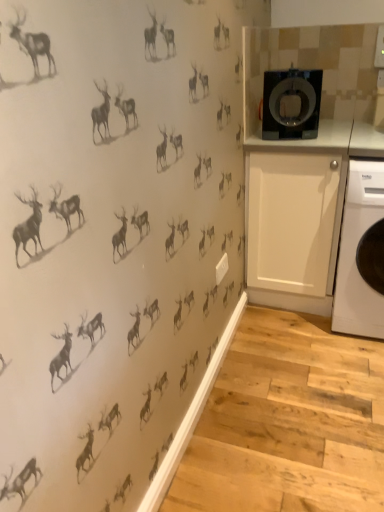
Question: Considering the relative positions of white matte cabinet at right and black glossy washing machine at upper right in the image provided, is white matte cabinet at right behind black glossy washing machine at upper right?

Choices:
 (A) yes
 (B) no

Answer: (A)

Question: Can you confirm if white matte cabinet at right is shorter than black glossy washing machine at upper right?

Choices:
 (A) no
 (B) yes

Answer: (A)

Question: Is white matte cabinet at right directly adjacent to black glossy washing machine at upper right?

Choices:
 (A) no
 (B) yes

Answer: (A)

Question: Is white matte cabinet at right to the right of black glossy washing machine at upper right from the viewer's perspective?

Choices:
 (A) yes
 (B) no

Answer: (A)

Question: From the image's perspective, is white matte cabinet at right located above black glossy washing machine at upper right?

Choices:
 (A) no
 (B) yes

Answer: (A)

Question: Considering the relative sizes of white matte cabinet at right and black glossy washing machine at upper right in the image provided, is white matte cabinet at right smaller than black glossy washing machine at upper right?

Choices:
 (A) yes
 (B) no

Answer: (B)

Question: Does black glossy washing machine at upper right have a lesser width compared to white plastic washing machine at right?

Choices:
 (A) no
 (B) yes

Answer: (B)

Question: From a real-world perspective, is black glossy washing machine at upper right located beneath white plastic washing machine at right?

Choices:
 (A) no
 (B) yes

Answer: (A)

Question: Is black glossy washing machine at upper right positioned behind white plastic washing machine at right?

Choices:
 (A) yes
 (B) no

Answer: (A)

Question: Considering the relative sizes of black glossy washing machine at upper right and white plastic washing machine at right in the image provided, is black glossy washing machine at upper right wider than white plastic washing machine at right?

Choices:
 (A) yes
 (B) no

Answer: (B)

Question: Can white plastic washing machine at right be found inside black glossy washing machine at upper right?

Choices:
 (A) no
 (B) yes

Answer: (A)

Question: Can you confirm if black glossy washing machine at upper right is bigger than white plastic washing machine at right?

Choices:
 (A) no
 (B) yes

Answer: (A)

Question: Does black glossy washing machine at upper right have a greater height compared to white matte cabinet at right?

Choices:
 (A) yes
 (B) no

Answer: (B)